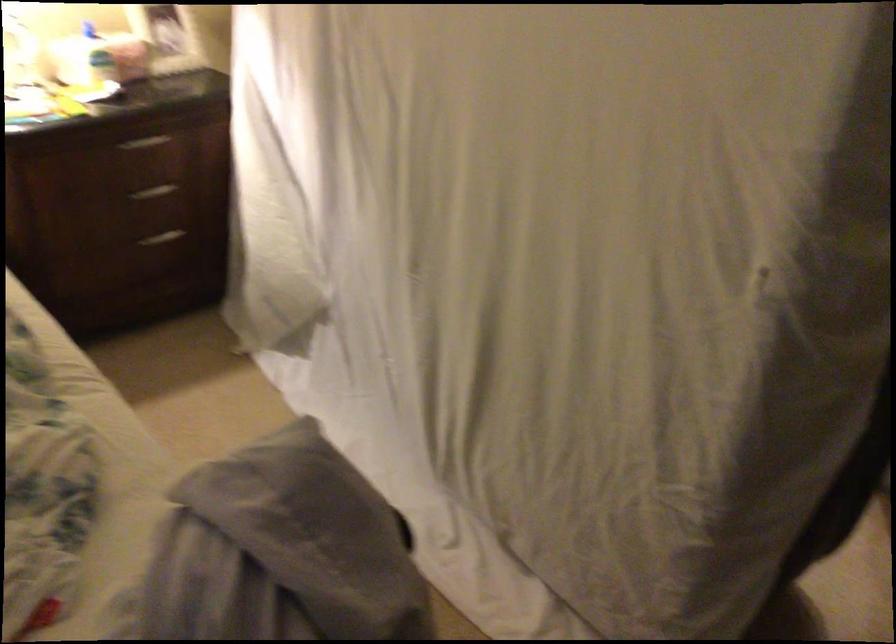
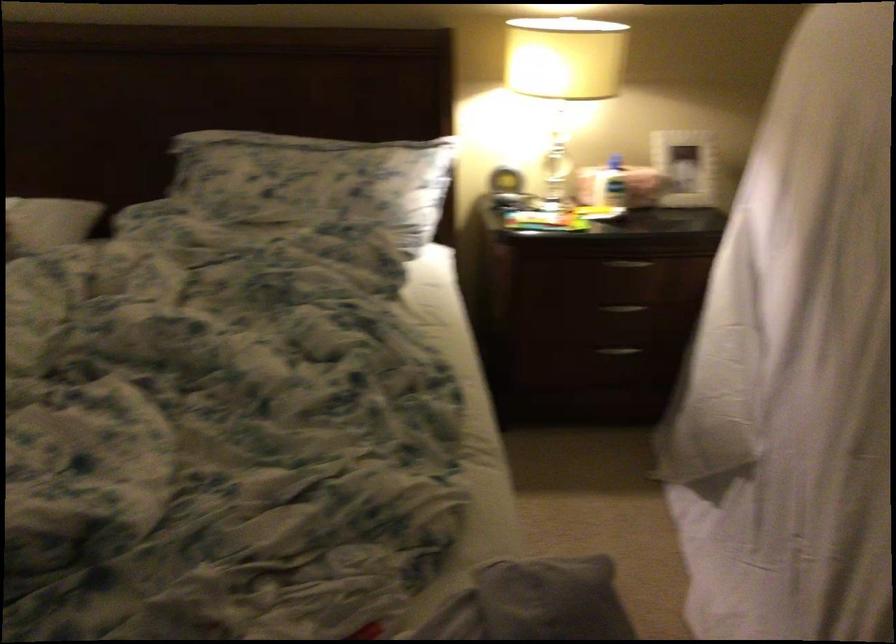
Question: The camera is either moving clockwise (left) or counter-clockwise (right) around the object. The first image is from the beginning of the video and the second image is from the end. Is the camera moving left or right when shooting the video?

Choices:
 (A) Left
 (B) Right

Answer: (B)